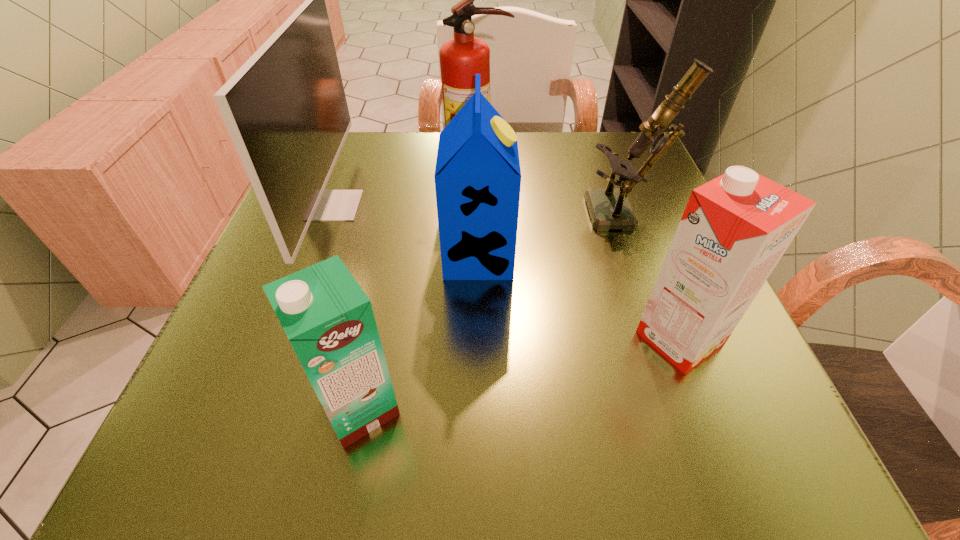
Where is `fire extinguisher`? fire extinguisher is located at coordinates (461, 58).

Locate an element on the screen. the leftmost object is located at coordinates (286, 111).

Where is `the second carton from right to left`? The width and height of the screenshot is (960, 540). the second carton from right to left is located at coordinates (477, 176).

Locate an element on the screen. This screenshot has width=960, height=540. microscope is located at coordinates (610, 208).

The image size is (960, 540). I want to click on the rightmost carton, so click(x=735, y=228).

Identify the location of the second object from left to right. (327, 317).

Where is `vacant space located 0.080m on the front-facing side of the fire extinguisher`? The width and height of the screenshot is (960, 540). vacant space located 0.080m on the front-facing side of the fire extinguisher is located at coordinates (477, 209).

At what (x,y) coordinates should I click in order to perform the action: click on free location located 0.390m on the front-facing side of the monitor. Please return your answer as a coordinate pair (x, y). The height and width of the screenshot is (540, 960). Looking at the image, I should click on (553, 205).

Locate an element on the screen. The width and height of the screenshot is (960, 540). vacant space positioned 0.100m with the cap open on the second carton from right to left is located at coordinates (569, 256).

This screenshot has width=960, height=540. What are the coordinates of `free space located 0.190m at the eyepiece of the microscope` in the screenshot? It's located at (492, 215).